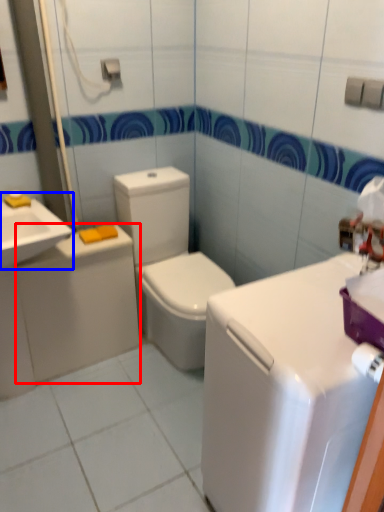
Question: Which of the following is the closest to the observer, appliance (highlighted by a red box) or sink (highlighted by a blue box)?

Choices:
 (A) appliance
 (B) sink

Answer: (B)